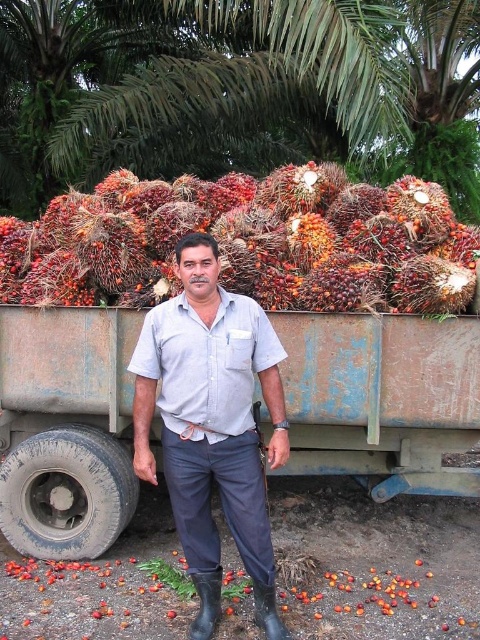
Which of these two, rusty metal wagon at center or light blue cotton shirt at center, stands taller?

Standing taller between the two is rusty metal wagon at center.

Which is more to the left, rusty metal wagon at center or light blue cotton shirt at center?

rusty metal wagon at center is more to the left.

Does point (373, 461) come in front of point (267, 342)?

No.

In order to click on rusty metal wagon at center in this screenshot , I will do `click(382, 397)`.

Is rusty metal wagon at center above green leafy palm at upper center?

Actually, rusty metal wagon at center is below green leafy palm at upper center.

Is point (35, 404) in front of point (208, 99)?

Yes, it is in front of point (208, 99).

Image resolution: width=480 pixels, height=640 pixels. In order to click on rusty metal wagon at center in this screenshot , I will do `click(382, 397)`.

Consider the image. Does rusty metal wagon at center have a lesser height compared to matte gray shirt at center?

Correct, rusty metal wagon at center is not as tall as matte gray shirt at center.

Looking at this image, how much distance is there between rusty metal wagon at center and matte gray shirt at center?

33.92 inches

Which is in front, point (61, 492) or point (222, 445)?

Point (222, 445)

You are a GUI agent. You are given a task and a screenshot of the screen. Output one action in this format:
    pyautogui.click(x=<x>, y=<y>)
    Task: Click on the rusty metal wagon at center
    The height and width of the screenshot is (640, 480).
    Given the screenshot: What is the action you would take?
    pyautogui.click(x=382, y=397)